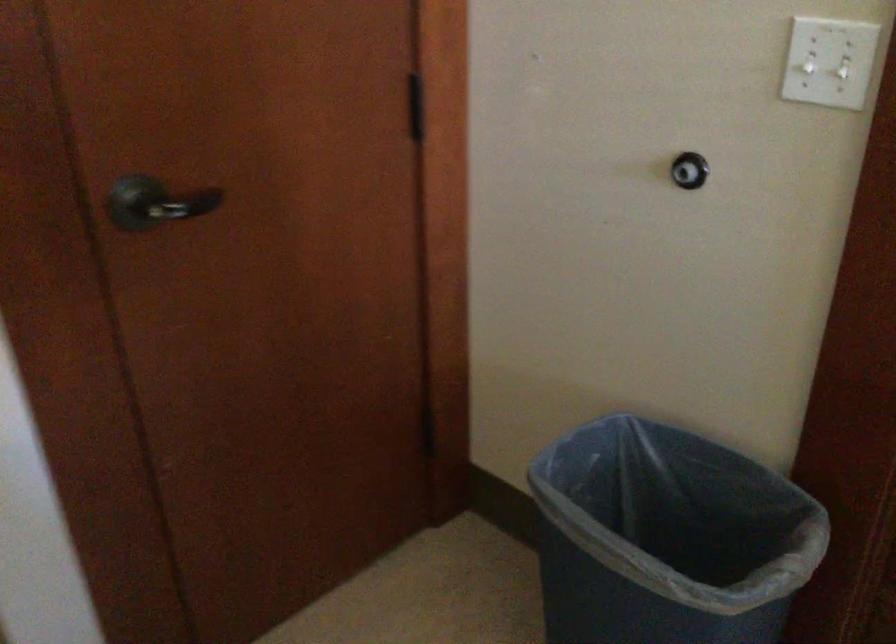
At what (x,y) coordinates should I click in order to perform the action: click on black door handle. Please return your answer as a coordinate pair (x, y). The image size is (896, 644). Looking at the image, I should click on (156, 203).